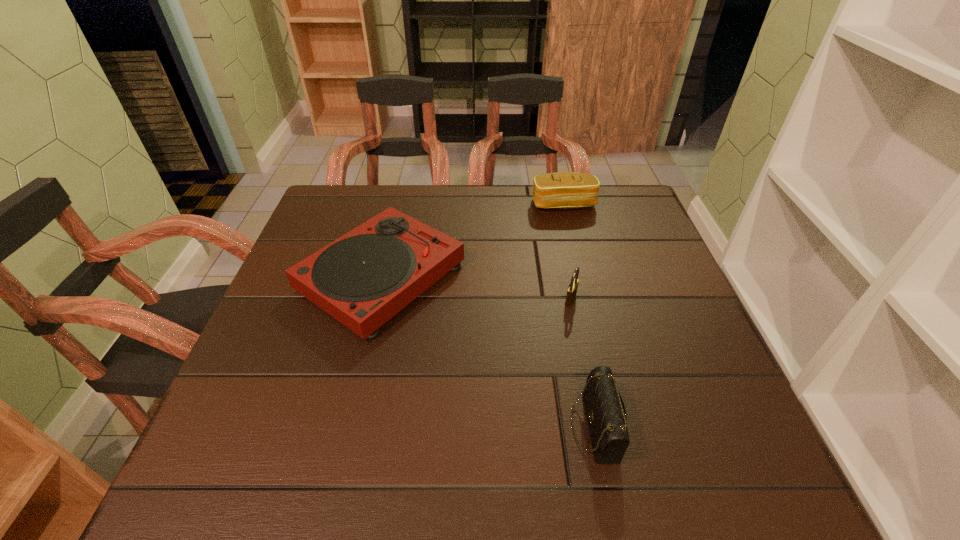
Find the location of a particular element. This screenshot has width=960, height=540. padlock is located at coordinates (572, 289).

Where is `the farthest object`? This screenshot has height=540, width=960. the farthest object is located at coordinates (562, 190).

Locate an element on the screen. The height and width of the screenshot is (540, 960). the leftmost object is located at coordinates (362, 279).

You are a GUI agent. You are given a task and a screenshot of the screen. Output one action in this format:
    pyautogui.click(x=<x>, y=<y>)
    Task: Click on the nearest object
    Image resolution: width=960 pixels, height=540 pixels.
    Given the screenshot: What is the action you would take?
    pyautogui.click(x=606, y=415)

Locate an element on the screen. free space located 0.150m on the back of the padlock is located at coordinates (561, 252).

Identify the location of vacant space located 0.120m on the zipper side of the farther clutch bag. (573, 241).

You are a GUI agent. You are given a task and a screenshot of the screen. Output one action in this format:
    pyautogui.click(x=<x>, y=<y>)
    Task: Click on the free spot located 0.110m on the back of the leftmost object
    The height and width of the screenshot is (540, 960).
    Given the screenshot: What is the action you would take?
    pyautogui.click(x=399, y=204)

I want to click on vacant space located on the front flap of the nearest object, so click(x=499, y=427).

Locate an element on the screen. The image size is (960, 540). vacant space situated on the front flap of the nearest object is located at coordinates (488, 427).

The image size is (960, 540). Identify the location of free space located 0.360m on the front flap of the nearest object. (371, 427).